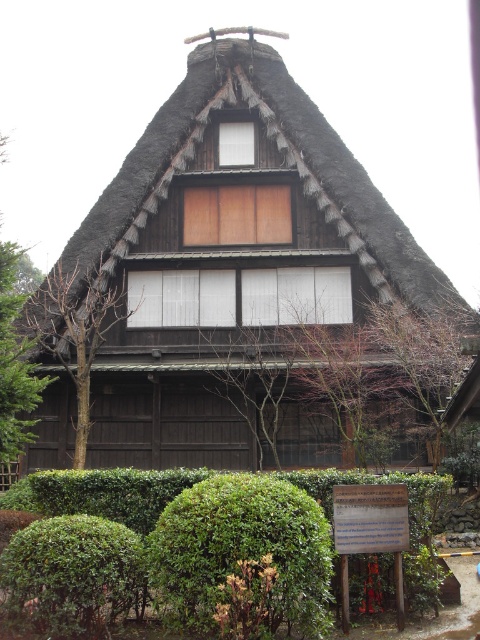
In the scene shown: You are standing in front of a traditional Japanese house with a thatched roof. You notice a point marked at coordinates (72, 573). Which object does this point correspond to?

The point at (72, 573) corresponds to the green leafy bush at lower left.

You are standing in front of a traditional Japanese house and see the thatched straw roof at center and the green leafy bush at lower left. Which object is located to the right of the other?

The thatched straw roof at center is positioned on the right side of green leafy bush at lower left.